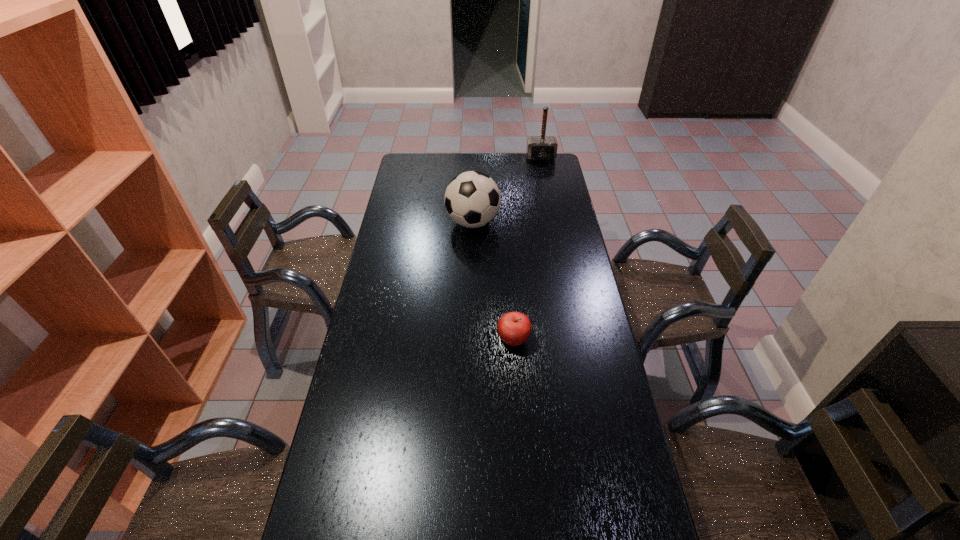
Identify the location of the rightmost object. The width and height of the screenshot is (960, 540). [540, 148].

What are the coordinates of `the farthest object` in the screenshot? It's located at (540, 148).

Find the location of `the second nearest object`. the second nearest object is located at coordinates (472, 199).

Where is `soccer ball`? The height and width of the screenshot is (540, 960). soccer ball is located at coordinates (472, 199).

Find the location of a particular element. the shortest object is located at coordinates (514, 328).

I want to click on the nearest object, so click(x=514, y=328).

Where is `vacant region located on the left of the hammer`? This screenshot has height=540, width=960. vacant region located on the left of the hammer is located at coordinates (489, 158).

This screenshot has width=960, height=540. I want to click on blank area located 0.130m on the front of the second tallest object, so click(x=472, y=260).

At what (x,y) coordinates should I click in order to perform the action: click on vacant space located on the right of the shortest object. Please return your answer as a coordinate pair (x, y). The width and height of the screenshot is (960, 540). Looking at the image, I should click on (563, 340).

Find the location of a particular element. Image resolution: width=960 pixels, height=540 pixels. object that is at the far edge is located at coordinates (540, 148).